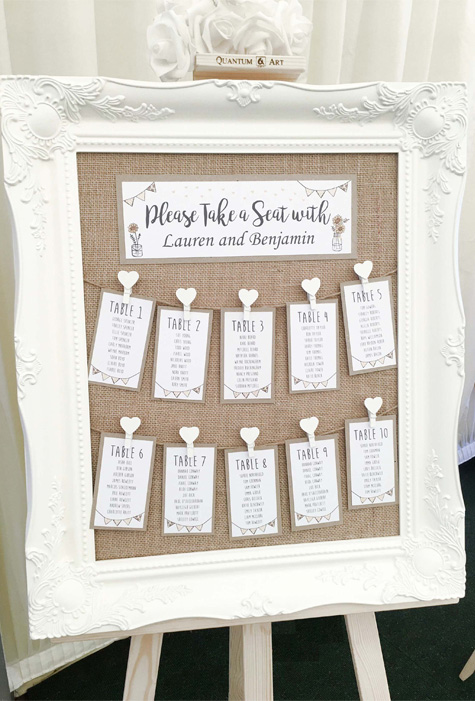
Where is `picture stand`? picture stand is located at coordinates (147, 676), (252, 660), (356, 645).